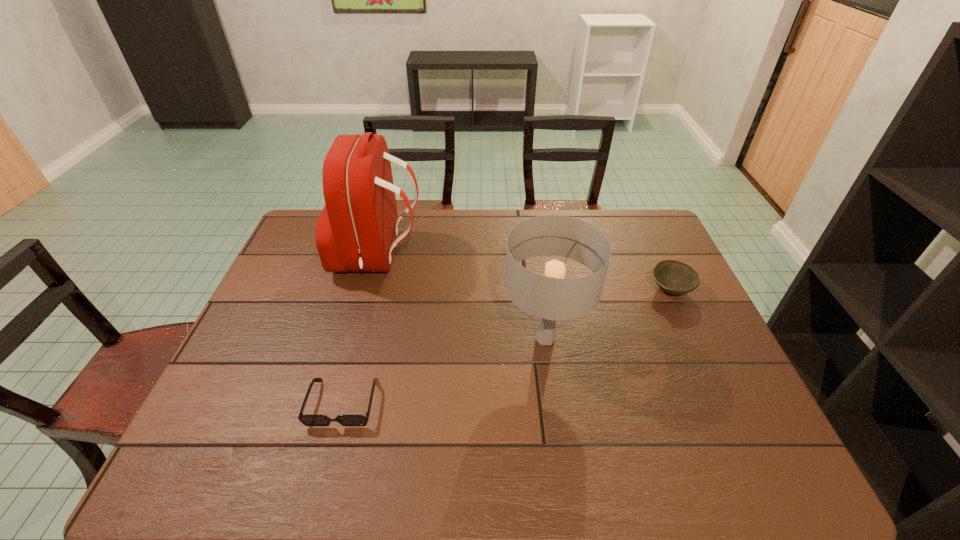
The image size is (960, 540). I want to click on vacant region that satisfies the following two spatial constraints: 1. on the front-facing side of the third shortest object; 2. on the front-facing side of the sunglasses, so click(554, 402).

Where is `vacant position in the image that satisfies the following two spatial constraints: 1. on the strap side of the backpack; 2. on the back side of the rightmost object`? vacant position in the image that satisfies the following two spatial constraints: 1. on the strap side of the backpack; 2. on the back side of the rightmost object is located at coordinates (370, 289).